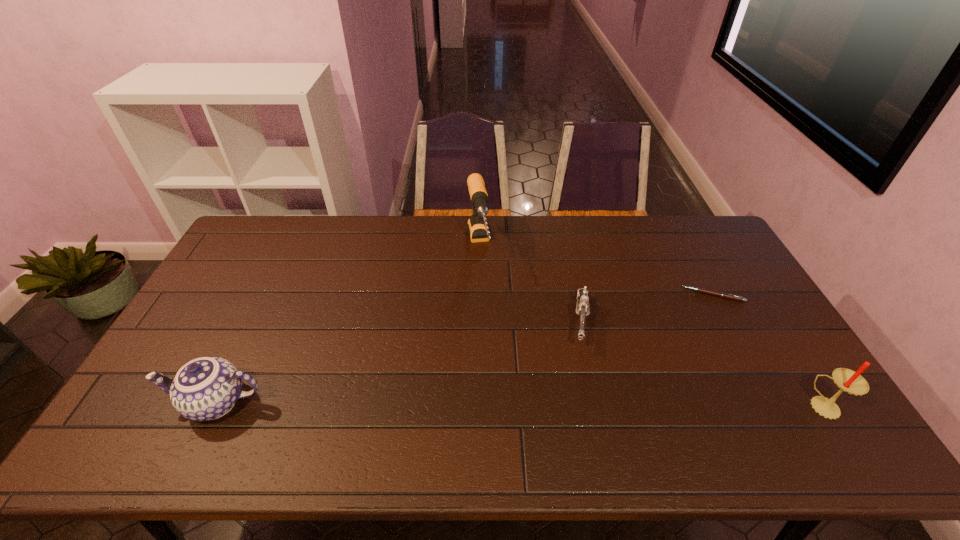
At what (x,y) coordinates should I click in order to perform the action: click on free space located 0.070m at the spout of the chinaware. Please return your answer as a coordinate pair (x, y). The image size is (960, 540). Looking at the image, I should click on click(x=140, y=402).

Image resolution: width=960 pixels, height=540 pixels. Identify the location of vacant space located on the left of the candle. (696, 406).

You are a GUI agent. You are given a task and a screenshot of the screen. Output one action in this format:
    pyautogui.click(x=<x>, y=<y>)
    Task: Click on the free space located 0.150m aimed along the barrel of the fourth tallest object
    The height and width of the screenshot is (540, 960).
    Given the screenshot: What is the action you would take?
    pyautogui.click(x=582, y=396)

At what (x,y) coordinates should I click in order to perform the action: click on vacant point located aimed along the barrel of the fourth tallest object. Please return your answer as a coordinate pair (x, y). The height and width of the screenshot is (540, 960). Looking at the image, I should click on (584, 374).

Locate an element on the screen. Image resolution: width=960 pixels, height=540 pixels. vacant area situated 0.120m aimed along the barrel of the fourth tallest object is located at coordinates (583, 386).

Find the location of `vacant position located 0.340m at the nib of the shortest object`. vacant position located 0.340m at the nib of the shortest object is located at coordinates 623,353.

The width and height of the screenshot is (960, 540). I want to click on free location located at the nib of the shortest object, so (634, 345).

Image resolution: width=960 pixels, height=540 pixels. In order to click on blank space located 0.310m at the nib of the shortest object in this screenshot , I will do `click(630, 348)`.

The width and height of the screenshot is (960, 540). Identify the location of free space located 0.300m on the handle side of the drill. (494, 352).

Where is `vacant area situated on the handle side of the drill`? vacant area situated on the handle side of the drill is located at coordinates (487, 313).